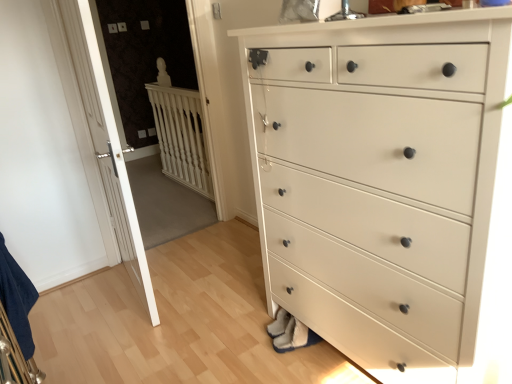
Locate an element on the screen. Image resolution: width=512 pixels, height=384 pixels. vacant space in front of white wood balustrade at upper left is located at coordinates (165, 209).